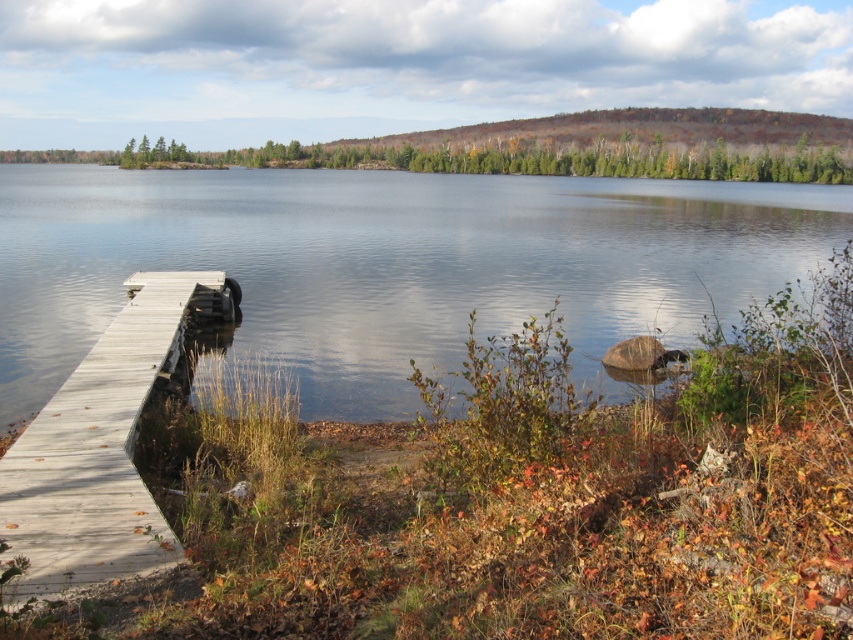
Does transparent water at center lie behind light gray wooden dock at lower left?

Yes.

Between transparent water at center and light gray wooden dock at lower left, which one has more height?

transparent water at center

Between point (643, 186) and point (79, 400), which one is positioned behind?

The point (643, 186) is behind.

This screenshot has height=640, width=853. I want to click on transparent water at center, so click(x=392, y=264).